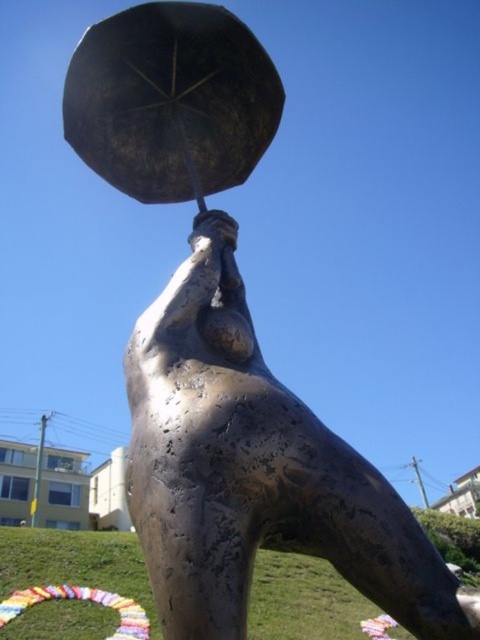
Is point (135, 506) less distant than point (215, 29)?

Yes, point (135, 506) is in front of point (215, 29).

Who is shorter, bronze statue at center or shiny bronze umbrella at upper center?

shiny bronze umbrella at upper center

Describe the element at coordinates (254, 472) in the screenshot. Image resolution: width=480 pixels, height=640 pixels. I see `bronze statue at center` at that location.

Identify the location of bronze statue at center. (254, 472).